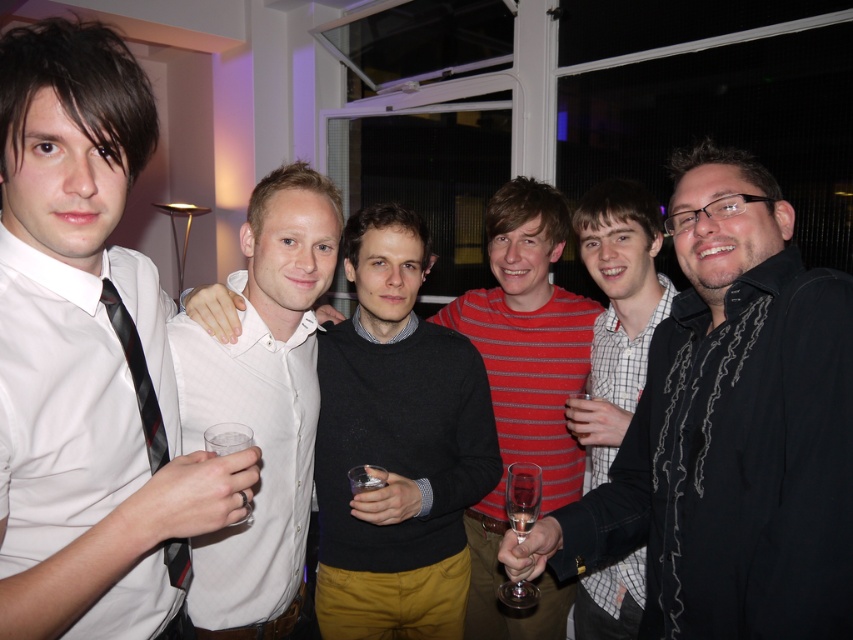
You are organizing a photo shoot and need to arrange two white shirts for a display. The shirts belong to the people in the image labeled as white shirt at left and white shirt at center. Which shirt should you choose if you want the larger one for the main display?

The white shirt at left is bigger than the white shirt at center, so you should choose the white shirt at left for the main display.

You are taking a photo of the group and want to focus on the point at the bottom right corner of the image, which is point (x=22, y=612). However, you also need to ensure that the point at the top left corner, point (x=544, y=189), is still in focus. Given their positions relative to the camera, will both points be in focus at the same time?

Point (x=22, y=612) is closer to the camera than point (x=544, y=189). Therefore, if you focus on the closer point, the farther point may not be in focus, and vice versa. To have both in focus, you might need to adjust your focus or use a smaller aperture for a deeper depth of field.

Looking at this image, in the image, there are several people including a white shirt at left and others. Which person is located at the position marked by the point coordinates (90, 342)?

The white shirt at left is represented by point (90, 342).